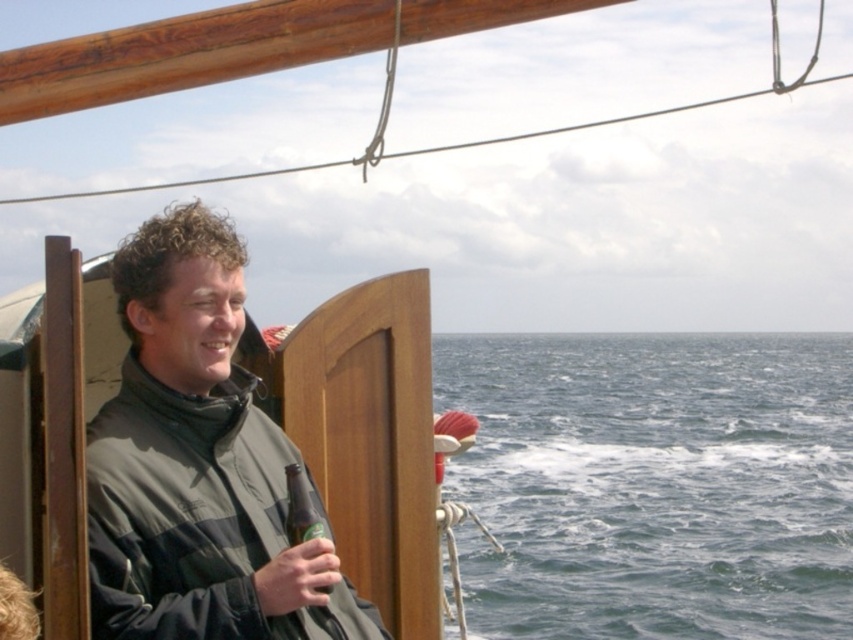
Locate an element on the screen. dark green matte jacket at left is located at coordinates (198, 464).

How much distance is there between dark green matte jacket at left and green glass bottle at center?

A distance of 43.48 centimeters exists between dark green matte jacket at left and green glass bottle at center.

This screenshot has height=640, width=853. I want to click on dark green matte jacket at left, so click(198, 464).

Does blue water at lower right appear over green glass bottle at center?

Actually, blue water at lower right is below green glass bottle at center.

Find the location of a particular element. The height and width of the screenshot is (640, 853). blue water at lower right is located at coordinates 654,483.

Where is `blue water at lower right`? blue water at lower right is located at coordinates (654, 483).

Does blue water at lower right have a smaller size compared to dark green matte jacket at left?

No.

Who is higher up, blue water at lower right or dark green matte jacket at left?

dark green matte jacket at left

Which is behind, point (721, 374) or point (229, 518)?

The point (721, 374) is more distant.

Locate an element on the screen. The width and height of the screenshot is (853, 640). blue water at lower right is located at coordinates (654, 483).